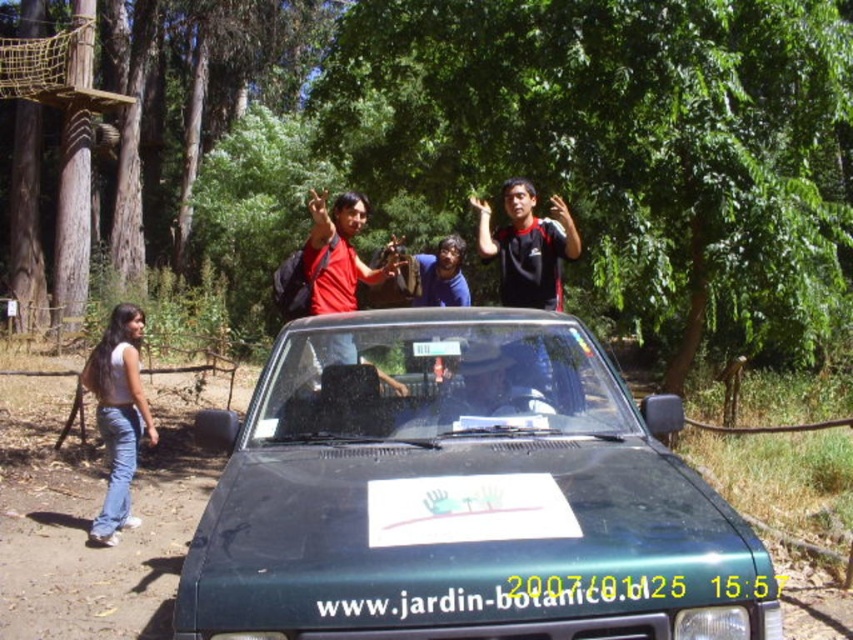
You are a photographer planning to take a picture of the green matte car at center and the white plastic license plate at center. If the camera frame can only accommodate objects up to 1.8 meters wide, will both fit side by side?

The green matte car at center might be wider than white plastic license plate at center. Since the car could be wider than 1.8 meters, it is possible that both objects together exceed the frame width. However, without exact measurements, we cannot confirm for certain.

You are a photographer standing at the edge of the dirt path in the park. You want to take a photo of the matte red shirt at center. Where should you position yourself to capture the shirt in the frame?

The matte red shirt at center is located at coordinates point (337,253), so you should position yourself at the edge of the dirt path facing towards the center of the scene to capture it in your frame.

What is located at the coordinate point (461, 496) in the image?

The green matte car at center is located at the coordinate point (461, 496).